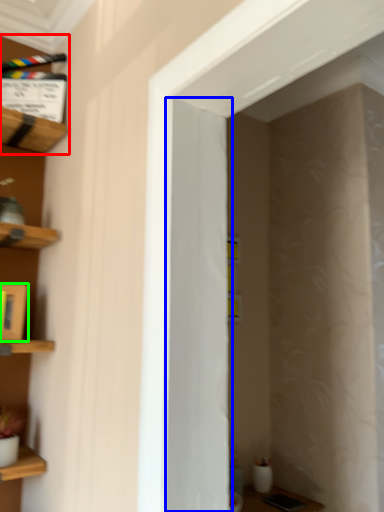
Question: Estimate the real-world distances between objects in this image. Which object is closer to shelf (highlighted by a red box), door (highlighted by a blue box) or cabinet (highlighted by a green box)?

Choices:
 (A) door
 (B) cabinet

Answer: (B)